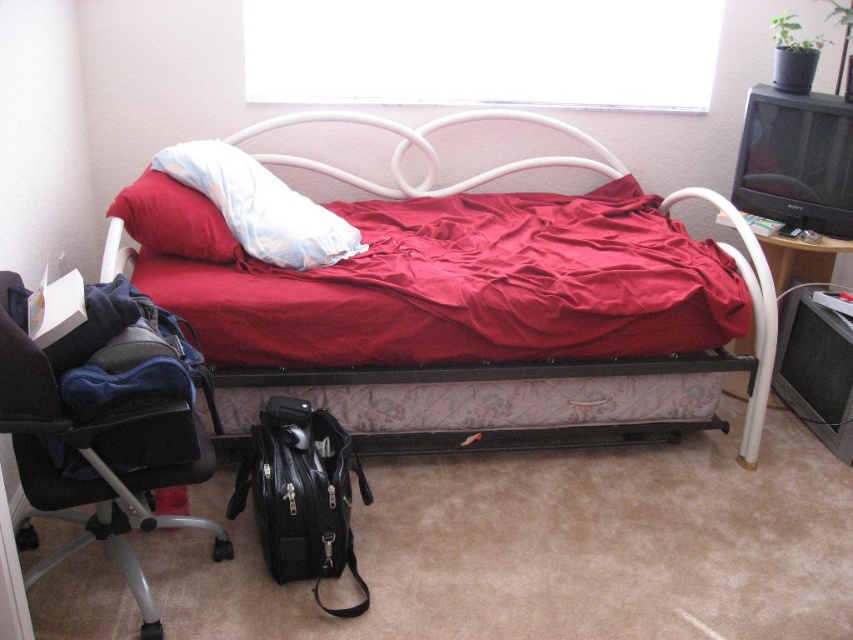
Does black leather bag at lower center have a greater width compared to white soft pillow at center?

In fact, black leather bag at lower center might be narrower than white soft pillow at center.

Does black leather bag at lower center have a lesser width compared to white soft pillow at center?

Indeed, black leather bag at lower center has a lesser width compared to white soft pillow at center.

Who is more forward, [321,460] or [239,224]?

Point [321,460]

Identify the location of black leather bag at lower center. This screenshot has width=853, height=640. (300, 496).

Is black leather chair at lower left in front of black leather bag at lower center?

Yes, black leather chair at lower left is closer to the viewer.

Which is more to the left, black leather chair at lower left or black leather bag at lower center?

black leather chair at lower left

Is point (134, 317) closer to camera compared to point (283, 532)?

Yes.

You are a GUI agent. You are given a task and a screenshot of the screen. Output one action in this format:
    pyautogui.click(x=<x>, y=<y>)
    Task: Click on the black leather chair at lower left
    The image size is (853, 640).
    Given the screenshot: What is the action you would take?
    pyautogui.click(x=97, y=449)

Which is in front, point (476, 221) or point (154, 234)?

Point (154, 234) is in front.

Does red matte blanket at center lie behind soft white pillow at upper left?

That is False.

Is point (547, 204) in front of point (178, 240)?

No, (547, 204) is behind (178, 240).

Image resolution: width=853 pixels, height=640 pixels. I want to click on red matte blanket at center, so click(468, 285).